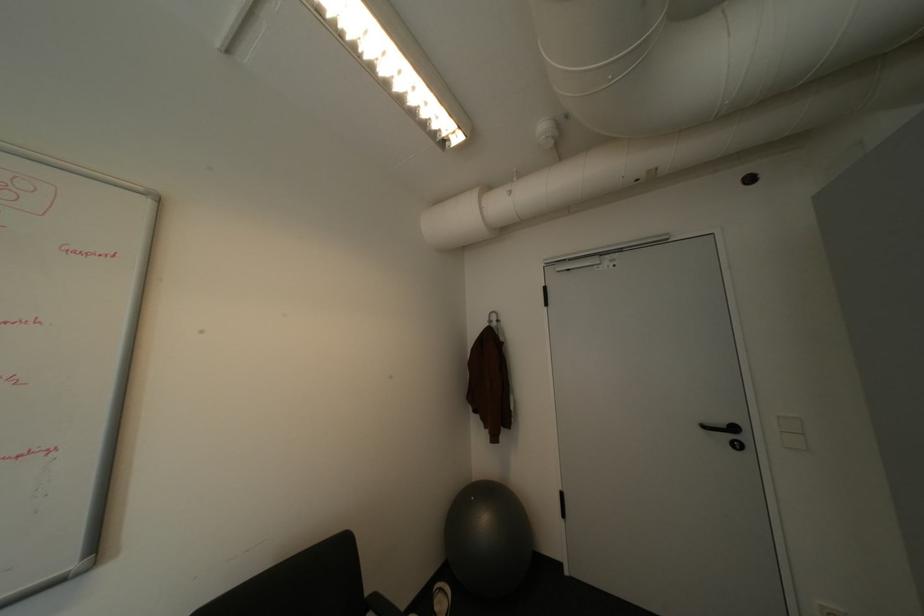
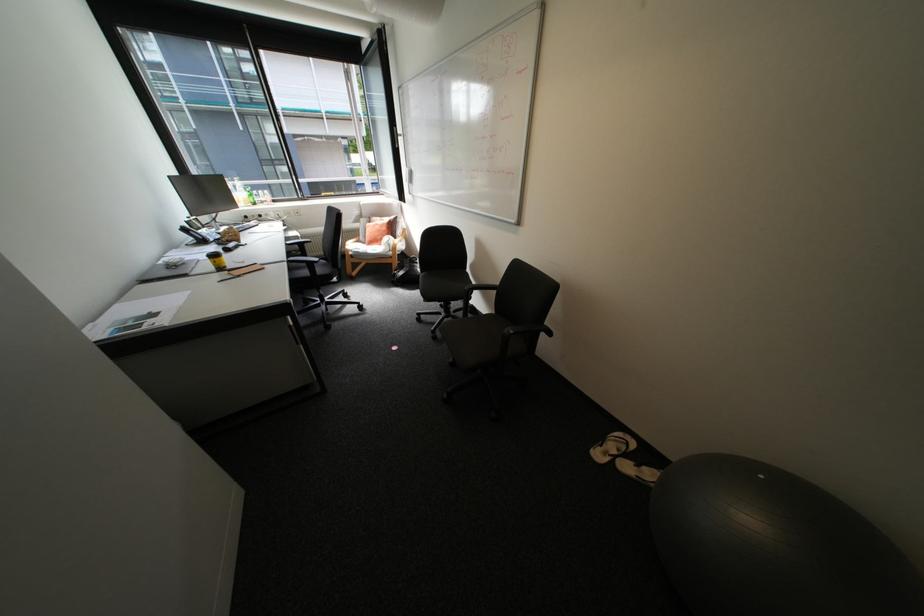
Question: I am providing you with two images of the same scene from different viewpoints. Which of the following objects are not visible in image2?

Choices:
 (A) wooden chair armrest
 (B) yellow travel mug
 (C) black chair sitting surface
 (D) none of these

Answer: (D)